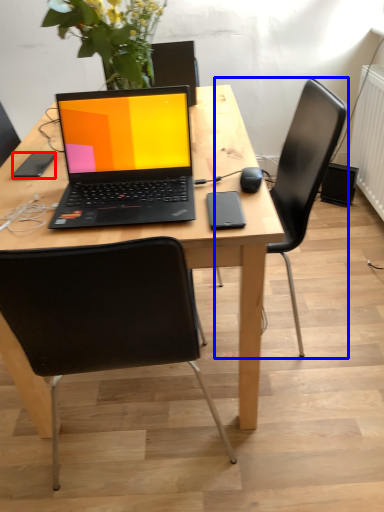
Question: Which object appears farthest to the camera in this image, mobile phone (highlighted by a red box) or chair (highlighted by a blue box)?

Choices:
 (A) mobile phone
 (B) chair

Answer: (A)